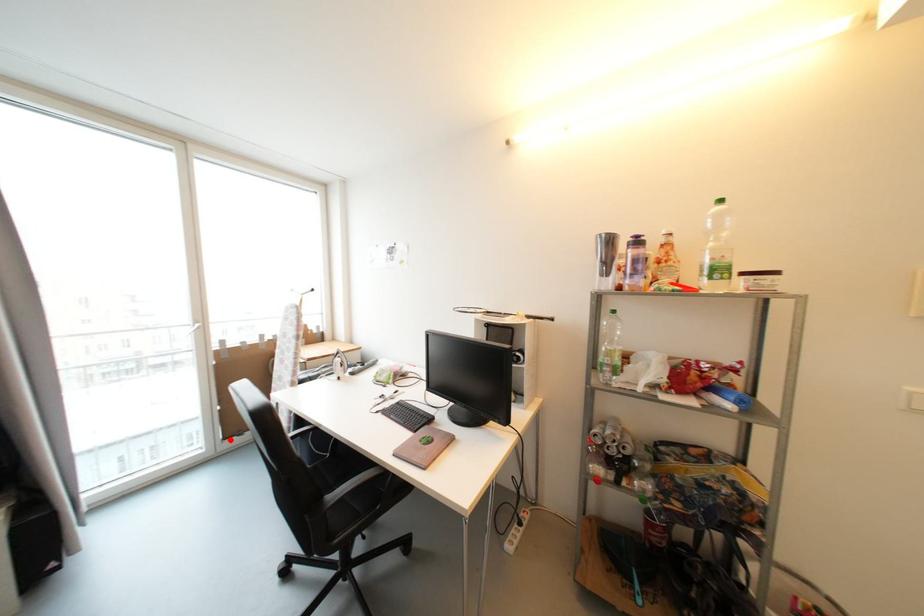
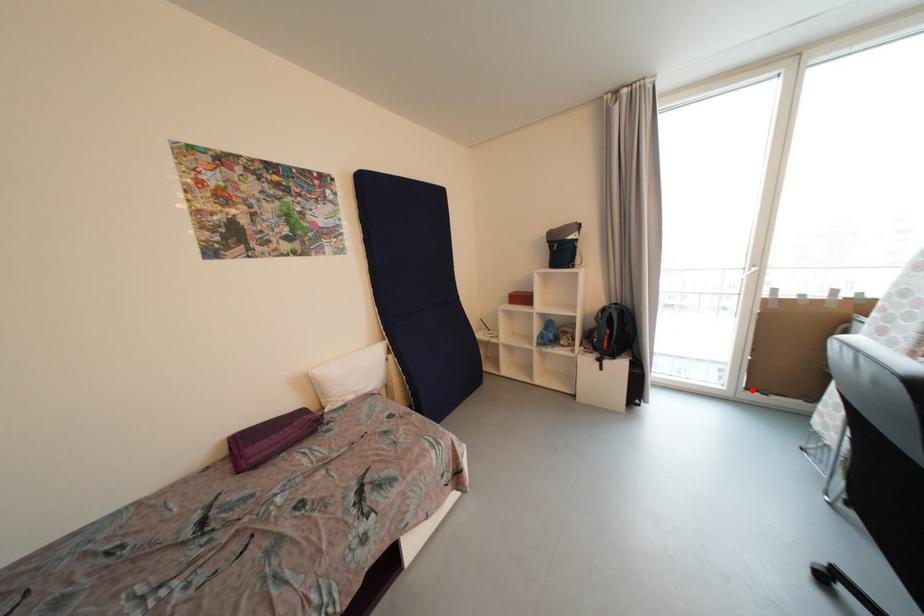
I am providing you with two images of the same scene from different viewpoints. A red point is marked on the first image and another point is marked on the second image. Is the marked point in image1 the same physical position as the marked point in image2?

Yes